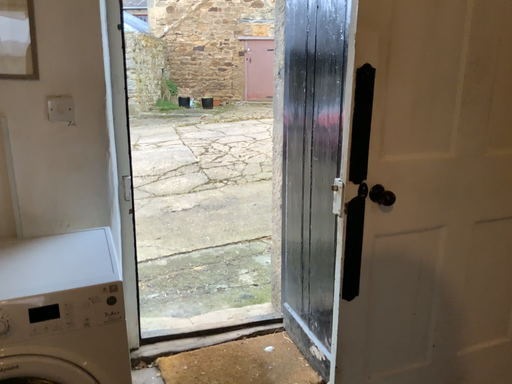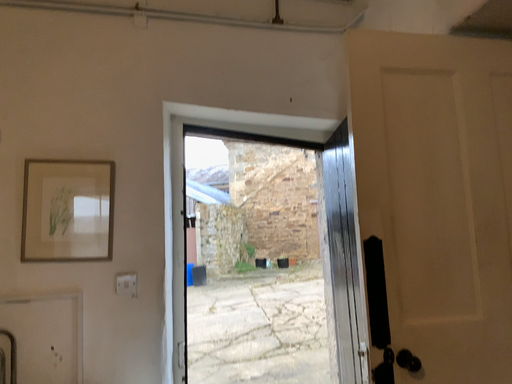
Question: How did the camera likely rotate when shooting the video?

Choices:
 (A) rotated downward
 (B) rotated upward

Answer: (B)